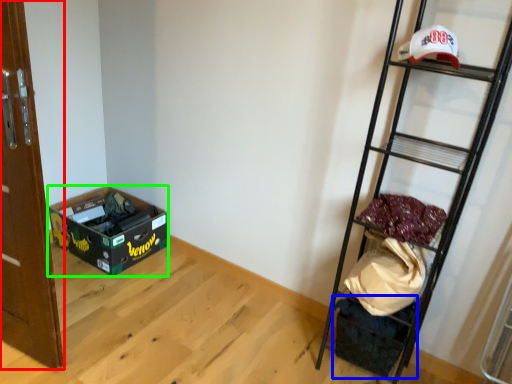
Question: Which object is positioned closest to door (highlighted by a red box)? Select from storage box (highlighted by a blue box) and box (highlighted by a green box).

Choices:
 (A) storage box
 (B) box

Answer: (B)